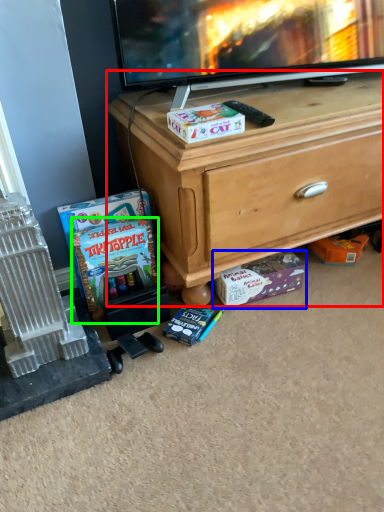
Question: Which object is the closest to the desk (highlighted by a red box)? Choose among these: cardboard box (highlighted by a blue box) or comic book (highlighted by a green box).

Choices:
 (A) cardboard box
 (B) comic book

Answer: (A)